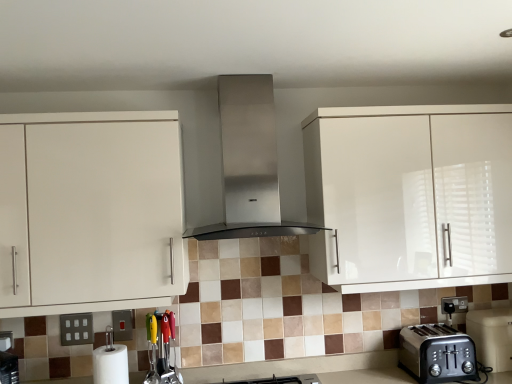
Question: Is brushed metal switch at lower left oriented towards multicolored plastic utensils at lower center, positioned as the 2th appliance in back-to-front order?

Choices:
 (A) no
 (B) yes

Answer: (A)

Question: Is the surface of brushed metal switch at lower left in direct contact with multicolored plastic utensils at lower center, positioned as the first appliance in left-to-right order?

Choices:
 (A) no
 (B) yes

Answer: (A)

Question: Can you confirm if brushed metal switch at lower left is wider than multicolored plastic utensils at lower center, which is counted as the first appliance, starting from the front?

Choices:
 (A) yes
 (B) no

Answer: (B)

Question: Can you confirm if brushed metal switch at lower left is smaller than multicolored plastic utensils at lower center, positioned as the first appliance in left-to-right order?

Choices:
 (A) no
 (B) yes

Answer: (B)

Question: Considering the relative sizes of brushed metal switch at lower left and multicolored plastic utensils at lower center, which is counted as the first appliance, starting from the front, in the image provided, is brushed metal switch at lower left bigger than multicolored plastic utensils at lower center, which is counted as the first appliance, starting from the front,?

Choices:
 (A) yes
 (B) no

Answer: (B)

Question: Can you confirm if brushed metal switch at lower left is positioned to the right of multicolored plastic utensils at lower center, which is the 2th appliance from right to left?

Choices:
 (A) no
 (B) yes

Answer: (A)

Question: Can you confirm if brushed metal switch at lower left is thinner than black plastic toaster at lower right, the first appliance from the right?

Choices:
 (A) yes
 (B) no

Answer: (A)

Question: From the image's perspective, is brushed metal switch at lower left located above black plastic toaster at lower right, the first appliance from the right?

Choices:
 (A) yes
 (B) no

Answer: (A)

Question: Is brushed metal switch at lower left oriented away from black plastic toaster at lower right, the first appliance from the right?

Choices:
 (A) no
 (B) yes

Answer: (A)

Question: Would you consider brushed metal switch at lower left to be distant from black plastic toaster at lower right, arranged as the first appliance when viewed from the back?

Choices:
 (A) no
 (B) yes

Answer: (B)

Question: Considering the relative sizes of brushed metal switch at lower left and black plastic toaster at lower right, arranged as the first appliance when viewed from the back, in the image provided, is brushed metal switch at lower left smaller than black plastic toaster at lower right, arranged as the first appliance when viewed from the back,?

Choices:
 (A) no
 (B) yes

Answer: (B)

Question: Is the depth of brushed metal switch at lower left less than that of black plastic toaster at lower right, the 2th appliance from the left?

Choices:
 (A) yes
 (B) no

Answer: (B)

Question: Can you confirm if white matte paper towel at lower left is positioned to the right of white glossy cabinet at left, the 1th cabinetry positioned from the left?

Choices:
 (A) no
 (B) yes

Answer: (B)